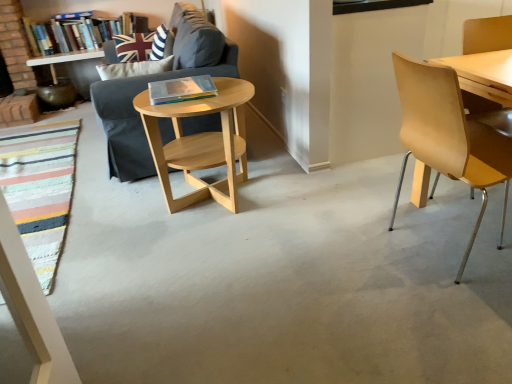
Find the location of `vacant area located to the right-hand side of hardcover book at center, the first book in the bottom-to-top sequence`. vacant area located to the right-hand side of hardcover book at center, the first book in the bottom-to-top sequence is located at coordinates (229, 92).